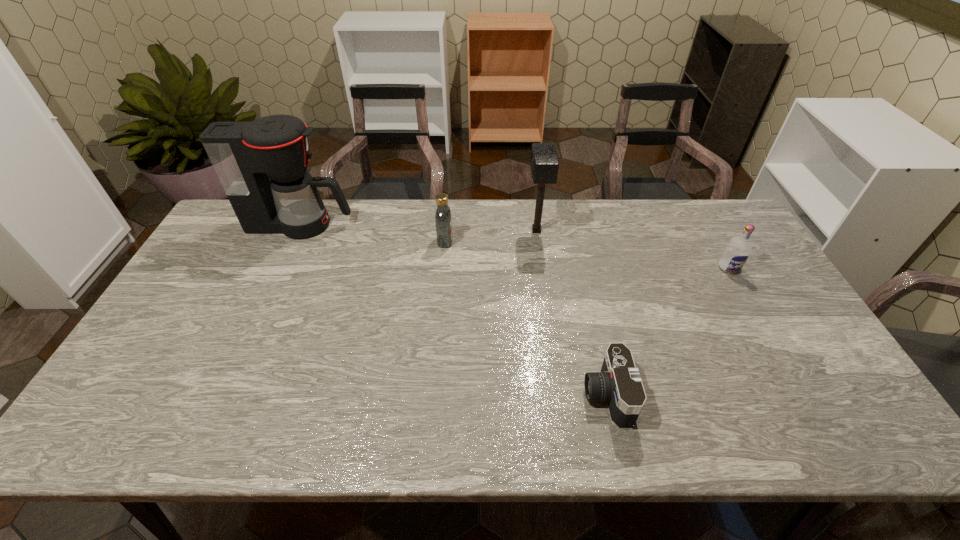
Locate an element on the screen. object that is at the near edge is located at coordinates (618, 383).

Locate an element on the screen. This screenshot has height=540, width=960. object positioned at the left edge is located at coordinates (262, 165).

Locate an element on the screen. object situated at the right edge is located at coordinates (738, 249).

The width and height of the screenshot is (960, 540). Find the location of `object that is at the far left corner`. object that is at the far left corner is located at coordinates (262, 165).

In the image, there is a desktop. Where is `free space at the far edge`? The height and width of the screenshot is (540, 960). free space at the far edge is located at coordinates (425, 226).

Find the location of a particular element. free space at the near edge of the desktop is located at coordinates (508, 414).

What are the coordinates of `free location at the left edge of the desktop` in the screenshot? It's located at 151,356.

Where is `vacant space at the right edge`? This screenshot has width=960, height=540. vacant space at the right edge is located at coordinates (752, 283).

The width and height of the screenshot is (960, 540). Identify the location of free space at the far right corner of the desktop. (724, 232).

Locate an element on the screen. vacant space at the near right corner of the desktop is located at coordinates (833, 416).